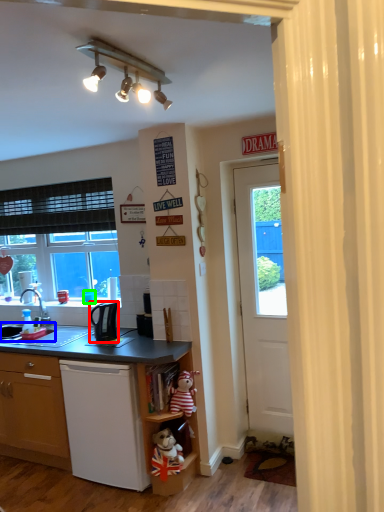
Question: Which object is positioned closest to corded phone (highlighted by a red box)? Select from sink (highlighted by a blue box) and coffee cup (highlighted by a green box).

Choices:
 (A) sink
 (B) coffee cup

Answer: (B)